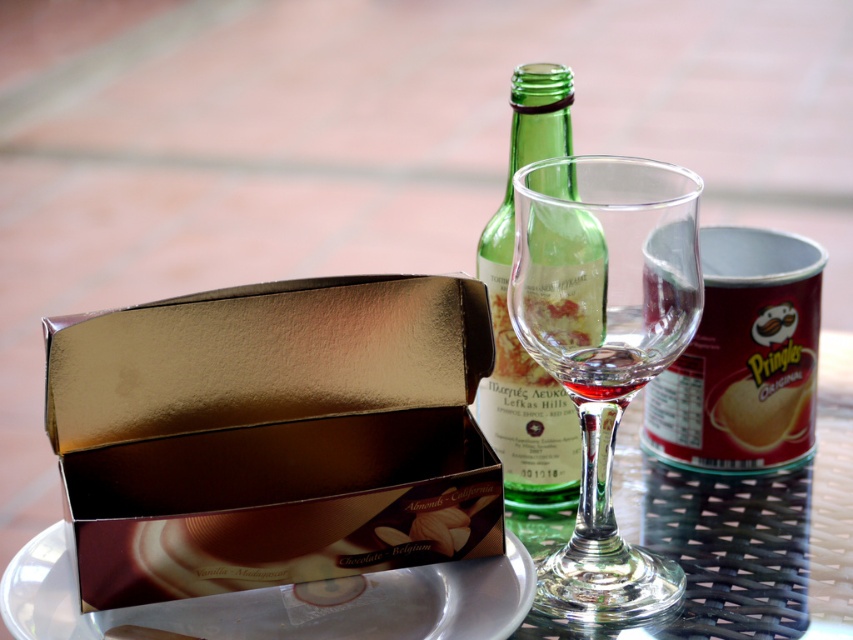
You are setting up a dinner table and need to place a decorative napkin. The napkin is 15 cm wide. You have a white glossy plate at center and a green glass bottle at center. Which item can the napkin fit under without overlapping the edges?

The white glossy plate at center has a larger width than the green glass bottle at center, so the napkin can fit under the white glossy plate at center since it is wider than the napkin.

You are a chef preparing a dish and need to place a garnish on the white glossy plate at center. The garnish must be placed exactly 15 centimeters away from the matte gold box at center. Can you position the garnish correctly on the plate?

The white glossy plate at center is 16.78 centimeters from the matte gold box at center. Since the required distance is 15 centimeters, the garnish cannot be placed exactly at that distance because the plate itself is already farther away than needed.